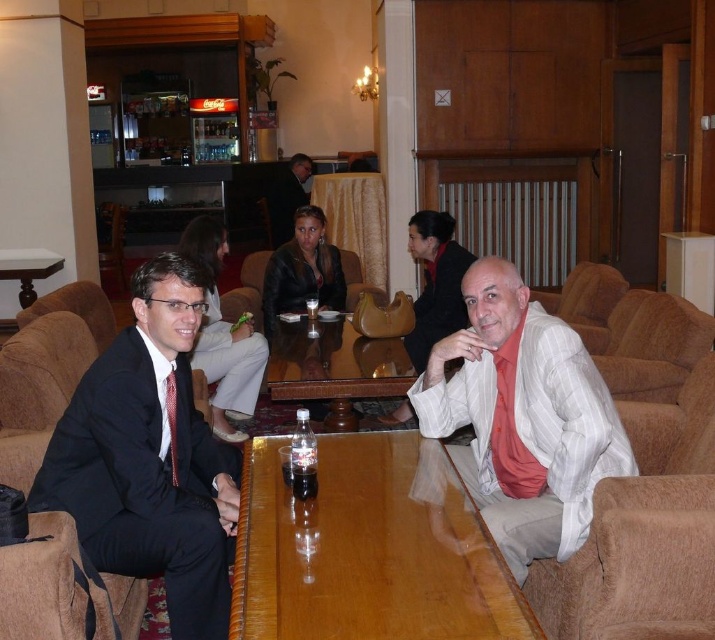
How much distance is there between dark blue suit at left and wooden table at center?

1.11 meters

Locate an element on the screen. The height and width of the screenshot is (640, 715). dark blue suit at left is located at coordinates (149, 458).

Between leather jacket at center and black plastic bottle at center, which one appears on the left side from the viewer's perspective?

Positioned to the left is leather jacket at center.

Does leather jacket at center have a lesser width compared to black plastic bottle at center?

Incorrect, leather jacket at center's width is not less than black plastic bottle at center's.

Is point (262, 307) farther from viewer compared to point (315, 488)?

Yes, point (262, 307) is behind point (315, 488).

You are a GUI agent. You are given a task and a screenshot of the screen. Output one action in this format:
    pyautogui.click(x=<x>, y=<y>)
    Task: Click on the leather jacket at center
    The width and height of the screenshot is (715, 640).
    Given the screenshot: What is the action you would take?
    pyautogui.click(x=302, y=269)

In the scene shown: Who is more forward, (x=506, y=460) or (x=84, y=294)?

Point (x=506, y=460)

Describe the element at coordinates (522, 417) in the screenshot. I see `white striped shirt at center` at that location.

Identify the location of white striped shirt at center. The width and height of the screenshot is (715, 640). (522, 417).